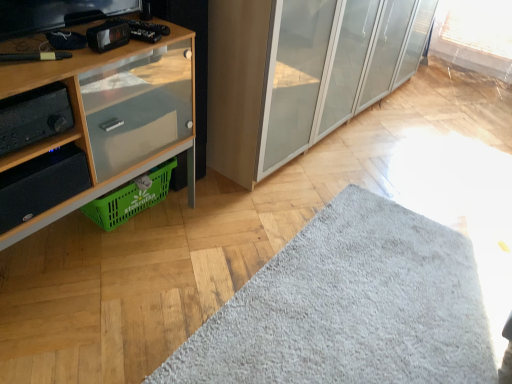
Question: Considering the relative sizes of transparent glass cabinet at center and wooden cabinet at left in the image provided, is transparent glass cabinet at center taller than wooden cabinet at left?

Choices:
 (A) yes
 (B) no

Answer: (A)

Question: Considering the relative sizes of transparent glass cabinet at center and wooden cabinet at left in the image provided, is transparent glass cabinet at center thinner than wooden cabinet at left?

Choices:
 (A) no
 (B) yes

Answer: (A)

Question: Is wooden cabinet at left located within transparent glass cabinet at center?

Choices:
 (A) no
 (B) yes

Answer: (A)

Question: Can you confirm if transparent glass cabinet at center is bigger than wooden cabinet at left?

Choices:
 (A) no
 (B) yes

Answer: (B)

Question: From the image's perspective, is transparent glass cabinet at center over wooden cabinet at left?

Choices:
 (A) yes
 (B) no

Answer: (A)

Question: From a real-world perspective, is transparent glass cabinet at center located higher than wooden cabinet at left?

Choices:
 (A) yes
 (B) no

Answer: (A)

Question: Would you consider gray fluffy mat at lower center to be distant from black matte stereo at left?

Choices:
 (A) no
 (B) yes

Answer: (B)

Question: Is gray fluffy mat at lower center located outside black matte stereo at left?

Choices:
 (A) yes
 (B) no

Answer: (A)

Question: Can you confirm if gray fluffy mat at lower center is shorter than black matte stereo at left?

Choices:
 (A) no
 (B) yes

Answer: (B)

Question: From a real-world perspective, is gray fluffy mat at lower center positioned over black matte stereo at left based on gravity?

Choices:
 (A) no
 (B) yes

Answer: (A)

Question: Does gray fluffy mat at lower center have a larger size compared to black matte stereo at left?

Choices:
 (A) yes
 (B) no

Answer: (A)

Question: Is gray fluffy mat at lower center wider than black matte stereo at left?

Choices:
 (A) no
 (B) yes

Answer: (B)

Question: Is green plastic basket at lower left outside black matte stereo at left?

Choices:
 (A) yes
 (B) no

Answer: (A)